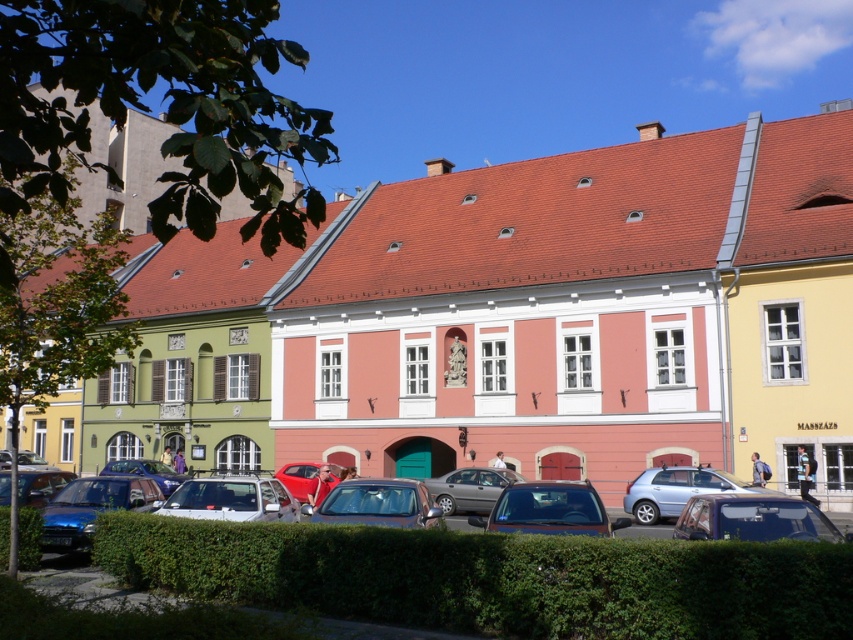
You are a delivery driver who needs to park your delivery van, which is 2 meters tall, in the parking spot between the silver metallic suv at center and the silver metallic sedan at center. Can your van fit there based on the height of the vehicles next to it?

The silver metallic suv at center is shorter than the silver metallic sedan at center. Since the delivery van is 2 meters tall, but the description only compares their heights without specifying exact measurements, it is unclear if the van will fit. You should check the exact height requirements of the parking spot.

You are standing on the street looking towards the pink building. You see a shiny red car at center and a metallic silver car at lower left. Which car is closer to you?

The shiny red car at center is closer to you because the metallic silver car at lower left is behind it.

Consider the image. You are standing in front of the pink building and want to take a photo. There are two points marked on the building, point A at coordinates point [4,552] and point B at coordinates point [172,468]. Which point is closer to your camera when taking the photo?

Point A at coordinates point [4,552] is closer to the camera than point B at coordinates point [172,468].